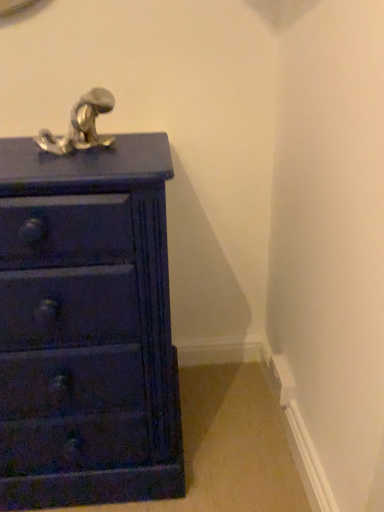
Question: From a real-world perspective, is matte dark blue chest of drawers at left physically above satin nickel faucet at upper left?

Choices:
 (A) yes
 (B) no

Answer: (B)

Question: Considering the relative sizes of matte dark blue chest of drawers at left and satin nickel faucet at upper left in the image provided, is matte dark blue chest of drawers at left taller than satin nickel faucet at upper left?

Choices:
 (A) no
 (B) yes

Answer: (B)

Question: Is the position of matte dark blue chest of drawers at left more distant than that of satin nickel faucet at upper left?

Choices:
 (A) no
 (B) yes

Answer: (A)

Question: Is matte dark blue chest of drawers at left directly adjacent to satin nickel faucet at upper left?

Choices:
 (A) yes
 (B) no

Answer: (B)

Question: Can you confirm if matte dark blue chest of drawers at left is shorter than satin nickel faucet at upper left?

Choices:
 (A) no
 (B) yes

Answer: (A)

Question: Is matte dark blue chest of drawers at left at the left side of satin nickel faucet at upper left?

Choices:
 (A) no
 (B) yes

Answer: (B)

Question: From a real-world perspective, is satin nickel faucet at upper left on matte dark blue chest of drawers at left?

Choices:
 (A) yes
 (B) no

Answer: (A)

Question: From a real-world perspective, is satin nickel faucet at upper left located beneath matte dark blue chest of drawers at left?

Choices:
 (A) no
 (B) yes

Answer: (A)

Question: Is satin nickel faucet at upper left positioned before matte dark blue chest of drawers at left?

Choices:
 (A) yes
 (B) no

Answer: (B)

Question: From the image's perspective, is satin nickel faucet at upper left located above matte dark blue chest of drawers at left?

Choices:
 (A) no
 (B) yes

Answer: (B)

Question: Can you confirm if satin nickel faucet at upper left is thinner than matte dark blue chest of drawers at left?

Choices:
 (A) no
 (B) yes

Answer: (B)

Question: Does satin nickel faucet at upper left have a smaller size compared to matte dark blue chest of drawers at left?

Choices:
 (A) no
 (B) yes

Answer: (B)

Question: Considering the positions of matte dark blue chest of drawers at left and satin nickel faucet at upper left in the image, is matte dark blue chest of drawers at left wider or thinner than satin nickel faucet at upper left?

Choices:
 (A) thin
 (B) wide

Answer: (B)